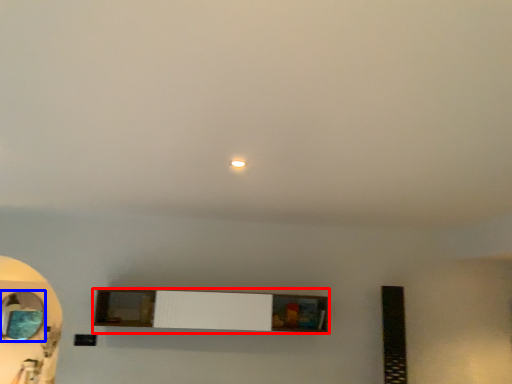
Question: Which object is further to the camera taking this photo, shelf (highlighted by a red box) or mirror (highlighted by a blue box)?

Choices:
 (A) shelf
 (B) mirror

Answer: (B)